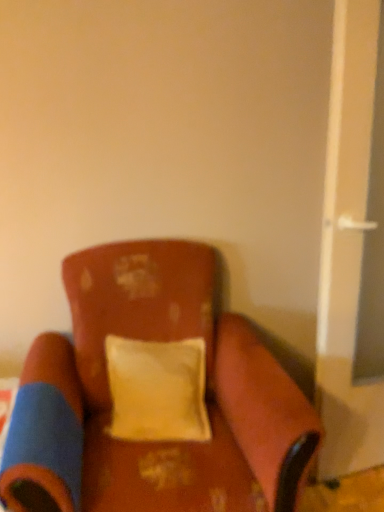
Question: Is white plastic screen door at right to the right of yellow fabric pillow at center from the viewer's perspective?

Choices:
 (A) yes
 (B) no

Answer: (A)

Question: From a real-world perspective, does white plastic screen door at right stand above yellow fabric pillow at center?

Choices:
 (A) yes
 (B) no

Answer: (A)

Question: Is white plastic screen door at right positioned beyond the bounds of yellow fabric pillow at center?

Choices:
 (A) yes
 (B) no

Answer: (A)

Question: Is white plastic screen door at right positioned in front of yellow fabric pillow at center?

Choices:
 (A) no
 (B) yes

Answer: (B)

Question: Is white plastic screen door at right oriented towards yellow fabric pillow at center?

Choices:
 (A) no
 (B) yes

Answer: (A)

Question: From a real-world perspective, is white plastic screen door at right physically below yellow fabric pillow at center?

Choices:
 (A) yes
 (B) no

Answer: (B)

Question: Can you confirm if yellow fabric pillow at center is bigger than white plastic screen door at right?

Choices:
 (A) yes
 (B) no

Answer: (B)

Question: Does yellow fabric pillow at center appear on the left side of white plastic screen door at right?

Choices:
 (A) yes
 (B) no

Answer: (A)

Question: Is yellow fabric pillow at center aimed at white plastic screen door at right?

Choices:
 (A) yes
 (B) no

Answer: (B)

Question: From the image's perspective, is yellow fabric pillow at center over white plastic screen door at right?

Choices:
 (A) yes
 (B) no

Answer: (B)

Question: Is yellow fabric pillow at center to the right of white plastic screen door at right from the viewer's perspective?

Choices:
 (A) no
 (B) yes

Answer: (A)

Question: Is yellow fabric pillow at center outside white plastic screen door at right?

Choices:
 (A) no
 (B) yes

Answer: (B)

Question: Can you confirm if velvet-like brown chair at center is shorter than white plastic screen door at right?

Choices:
 (A) yes
 (B) no

Answer: (A)